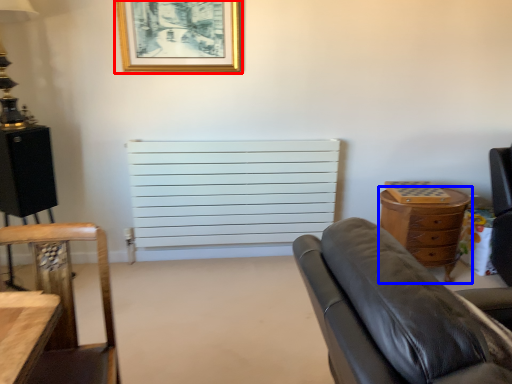
Question: Among these objects, which one is nearest to the camera, picture frame (highlighted by a red box) or chest of drawers (highlighted by a blue box)?

Choices:
 (A) picture frame
 (B) chest of drawers

Answer: (A)